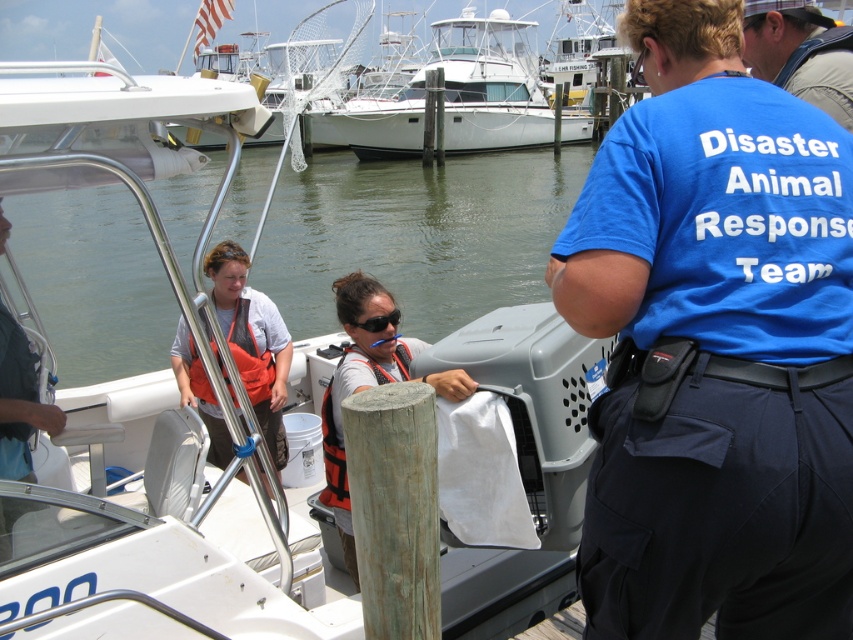
Question: Which object appears closest to the camera in this image?

Choices:
 (A) green wood pole at center
 (B) orange life vest at left
 (C) blue fabric shirt at upper right

Answer: (A)

Question: Is blue cotton shirt at center smaller than white plastic boat at center?

Choices:
 (A) no
 (B) yes

Answer: (B)

Question: Estimate the real-world distances between objects in this image. Which object is closer to the orange life jacket at center?

Choices:
 (A) blue cotton shirt at center
 (B) orange life vest at center
 (C) green wood pole at center
 (D) orange life jacket at left

Answer: (B)

Question: Is orange life vest at center thinner than orange life jacket at center?

Choices:
 (A) no
 (B) yes

Answer: (A)

Question: Does orange life jacket at left come behind black plastic goggles at center?

Choices:
 (A) no
 (B) yes

Answer: (B)

Question: Which of these objects is positioned closest to the orange life jacket at left?

Choices:
 (A) orange life vest at center
 (B) orange life vest at left
 (C) white plastic boat at center
 (D) white glossy boat at upper center

Answer: (B)